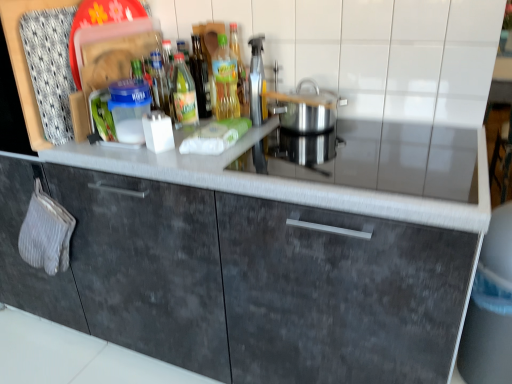
Where is `free space to the right of silver metallic pot at center`? free space to the right of silver metallic pot at center is located at coordinates (382, 129).